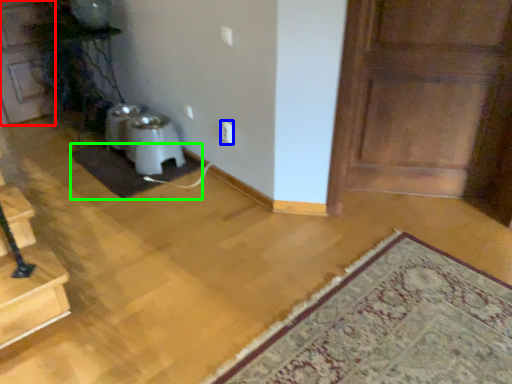
Question: Which object is positioned closest to door (highlighted by a red box)? Select from electric outlet (highlighted by a blue box) and doormat (highlighted by a green box).

Choices:
 (A) electric outlet
 (B) doormat

Answer: (B)